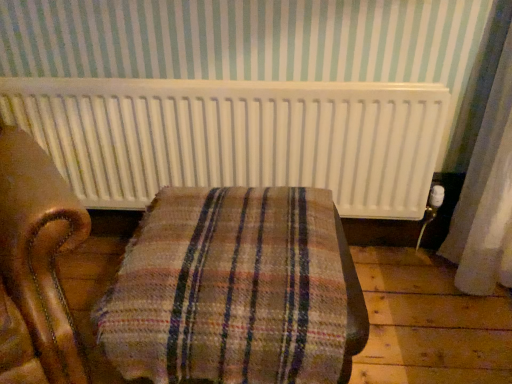
This screenshot has width=512, height=384. Identify the location of white matte radiator at upper center. (236, 137).

The width and height of the screenshot is (512, 384). Describe the element at coordinates (236, 137) in the screenshot. I see `white matte radiator at upper center` at that location.

Measure the distance between white matte radiator at upper center and camera.

A distance of 1.42 meters exists between white matte radiator at upper center and camera.

This screenshot has height=384, width=512. What do you see at coordinates (234, 290) in the screenshot? I see `plaid fabric ottoman at center` at bounding box center [234, 290].

Measure the distance between point [249,340] and camera.

The distance of point [249,340] from camera is 35.31 inches.

The image size is (512, 384). In order to click on plaid fabric ottoman at center in this screenshot , I will do `click(234, 290)`.

The height and width of the screenshot is (384, 512). Find the location of `white matte radiator at upper center`. white matte radiator at upper center is located at coordinates (236, 137).

Which is more to the right, plaid fabric ottoman at center or white matte radiator at upper center?

plaid fabric ottoman at center is more to the right.

Which is behind, plaid fabric ottoman at center or white matte radiator at upper center?

white matte radiator at upper center is behind.

Considering the positions of points (132, 348) and (328, 146), is point (132, 348) closer to camera compared to point (328, 146)?

Yes, point (132, 348) is closer to viewer.

From the image's perspective, is plaid fabric ottoman at center on white matte radiator at upper center?

Incorrect, from the image's perspective, plaid fabric ottoman at center is lower than white matte radiator at upper center.

From a real-world perspective, is plaid fabric ottoman at center located beneath white matte radiator at upper center?

Correct, in the physical world, plaid fabric ottoman at center is lower than white matte radiator at upper center.

Considering the relative sizes of plaid fabric ottoman at center and white matte radiator at upper center in the image provided, is plaid fabric ottoman at center thinner than white matte radiator at upper center?

In fact, plaid fabric ottoman at center might be wider than white matte radiator at upper center.

Which of these two, plaid fabric ottoman at center or white matte radiator at upper center, stands shorter?

With less height is white matte radiator at upper center.

Which of these two, plaid fabric ottoman at center or white matte radiator at upper center, is bigger?

Bigger between the two is plaid fabric ottoman at center.

Is plaid fabric ottoman at center positioned beyond the bounds of white matte radiator at upper center?

That's correct, plaid fabric ottoman at center is outside of white matte radiator at upper center.

Are plaid fabric ottoman at center and white matte radiator at upper center making contact?

No, plaid fabric ottoman at center is not making contact with white matte radiator at upper center.

Is plaid fabric ottoman at center looking in the opposite direction of white matte radiator at upper center?

Yes, white matte radiator at upper center is at the back of plaid fabric ottoman at center.

Locate an element on the screen. The image size is (512, 384). radiator that is above the plaid fabric ottoman at center (from a real-world perspective) is located at coordinates (236, 137).

Does white matte radiator at upper center appear on the left side of plaid fabric ottoman at center?

Correct, you'll find white matte radiator at upper center to the left of plaid fabric ottoman at center.

Is the depth of white matte radiator at upper center greater than that of plaid fabric ottoman at center?

That is True.

Which point is more forward, (276, 164) or (324, 292)?

The point (324, 292) is in front.

From the image's perspective, who appears lower, white matte radiator at upper center or plaid fabric ottoman at center?

plaid fabric ottoman at center, from the image's perspective.

From a real-world perspective, which object rests below the other?

From a 3D spatial view, plaid fabric ottoman at center is below.

Which object is thinner, white matte radiator at upper center or plaid fabric ottoman at center?

Thinner between the two is white matte radiator at upper center.

Considering the sizes of objects white matte radiator at upper center and plaid fabric ottoman at center in the image provided, who is taller, white matte radiator at upper center or plaid fabric ottoman at center?

plaid fabric ottoman at center.

Considering the sizes of objects white matte radiator at upper center and plaid fabric ottoman at center in the image provided, who is smaller, white matte radiator at upper center or plaid fabric ottoman at center?

white matte radiator at upper center is smaller.

Is plaid fabric ottoman at center completely or partially inside white matte radiator at upper center?

No, white matte radiator at upper center does not contain plaid fabric ottoman at center.

Is the surface of white matte radiator at upper center in direct contact with plaid fabric ottoman at center?

They are not placed beside each other.

Is white matte radiator at upper center facing towards plaid fabric ottoman at center?

Yes, white matte radiator at upper center is turned towards plaid fabric ottoman at center.

Can you tell me how much white matte radiator at upper center and plaid fabric ottoman at center differ in facing direction?

They differ by 0.000708 degrees in their facing directions.

Where is `furniture in front of the white matte radiator at upper center`? The width and height of the screenshot is (512, 384). furniture in front of the white matte radiator at upper center is located at coordinates (234, 290).

Image resolution: width=512 pixels, height=384 pixels. I want to click on furniture in front of the white matte radiator at upper center, so click(234, 290).

You are a GUI agent. You are given a task and a screenshot of the screen. Output one action in this format:
    pyautogui.click(x=<x>, y=<y>)
    Task: Click on the furniture located on the right of white matte radiator at upper center
    This screenshot has height=384, width=512.
    Given the screenshot: What is the action you would take?
    pyautogui.click(x=234, y=290)